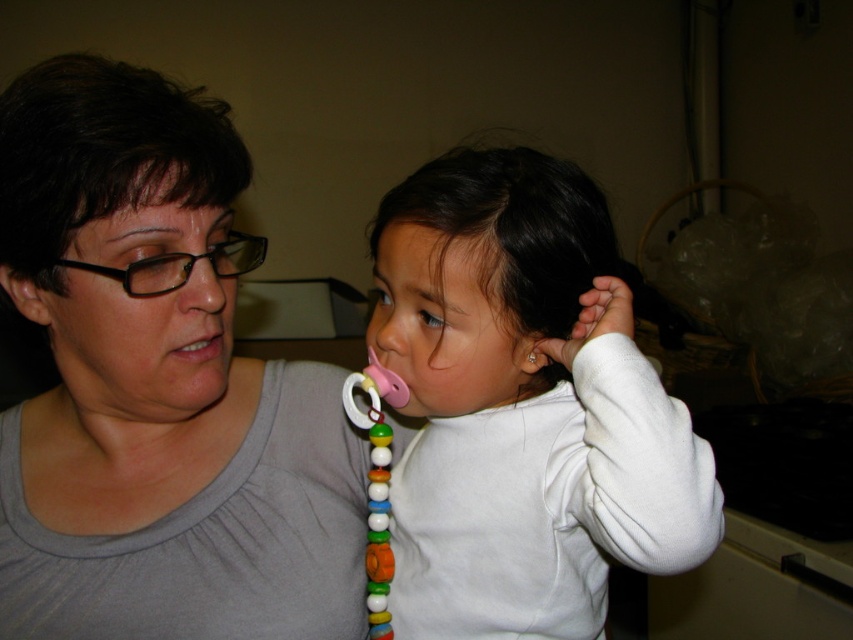
Is matte black nose at center smaller than pink plastic teething ring at center?

Actually, matte black nose at center might be larger than pink plastic teething ring at center.

Does point (202, 310) lie behind point (531, 349)?

No, it is in front of (531, 349).

Is point (204, 268) positioned after point (531, 349)?

No, it is not.

At what (x,y) coordinates should I click in order to perform the action: click on matte black nose at center. Please return your answer as a coordinate pair (x, y). The height and width of the screenshot is (640, 853). Looking at the image, I should click on (202, 291).

Locate an element on the screen. This screenshot has width=853, height=640. pink rubber pacifier at center is located at coordinates (526, 406).

Which is behind, point (515, 326) or point (230, 340)?

The point (230, 340) is behind.

This screenshot has height=640, width=853. What are the coordinates of `pink rubber pacifier at center` in the screenshot? It's located at (526, 406).

Can you confirm if smooth skin at center is wider than pink rubber nose at center?

No, smooth skin at center is not wider than pink rubber nose at center.

Does smooth skin at center appear on the left side of pink rubber nose at center?

Yes, smooth skin at center is to the left of pink rubber nose at center.

This screenshot has width=853, height=640. Describe the element at coordinates (436, 253) in the screenshot. I see `smooth skin at center` at that location.

Image resolution: width=853 pixels, height=640 pixels. In order to click on smooth skin at center in this screenshot , I will do point(436,253).